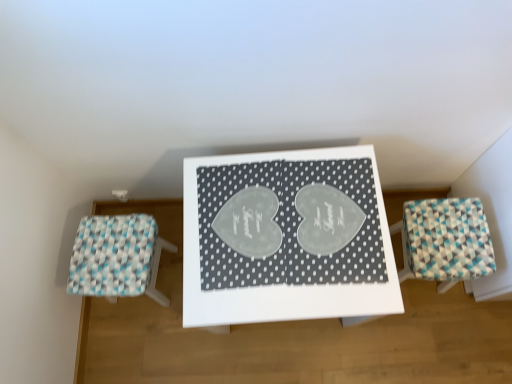
In order to click on free location in front of white woven stool at left, the 2th furniture positioned from the right in this screenshot , I will do `click(144, 339)`.